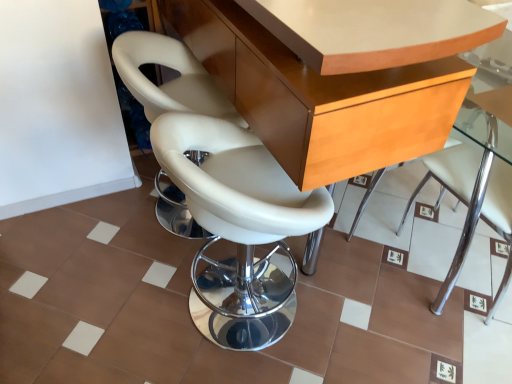
Image resolution: width=512 pixels, height=384 pixels. What are the coordinates of `free space to the left of light brown wood table at center` in the screenshot? It's located at (82, 258).